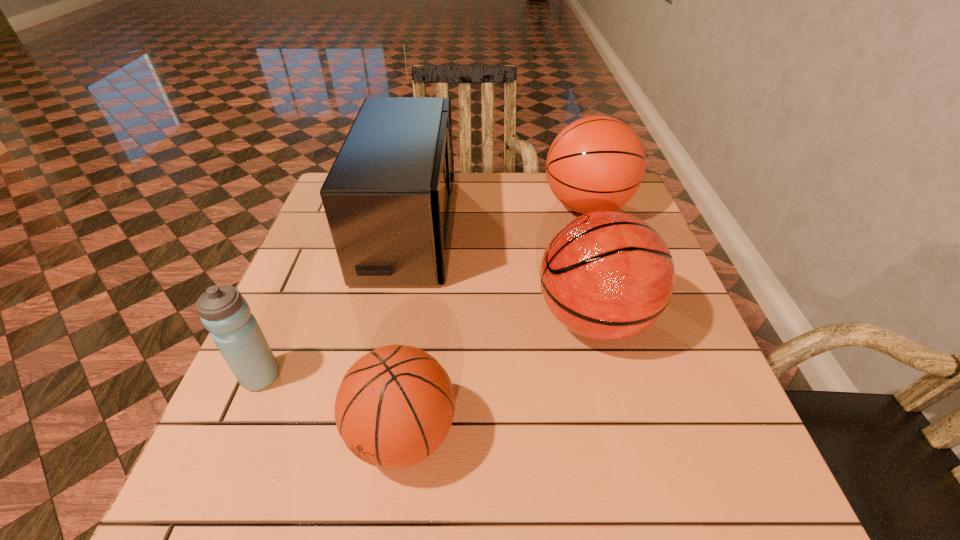
Identify the location of free space between the second farthest basketball and the microwave_oven. (501, 273).

The image size is (960, 540). I want to click on free space between the second nearest basketball and the water bottle, so coord(427,348).

At what (x,y) coordinates should I click in order to perform the action: click on free spot between the shortest object and the farthest basketball. Please return your answer as a coordinate pair (x, y). Image resolution: width=960 pixels, height=540 pixels. Looking at the image, I should click on click(x=495, y=321).

At what (x,y) coordinates should I click in order to perform the action: click on vacant point located between the microwave_oven and the leftmost object. Please return your answer as a coordinate pair (x, y). Image resolution: width=960 pixels, height=540 pixels. Looking at the image, I should click on (335, 302).

Locate which object is the second closest to the second nearest basketball. Please provide its 2D coordinates. Your answer should be formatted as a tuple, i.e. [(x, y)], where the tuple contains the x and y coordinates of a point satisfying the conditions above.

[(597, 163)]

Choose which object is the fourth nearest neighbor to the water bottle. Please provide its 2D coordinates. Your answer should be formatted as a tuple, i.e. [(x, y)], where the tuple contains the x and y coordinates of a point satisfying the conditions above.

[(597, 163)]

This screenshot has width=960, height=540. In order to click on the third closest basketball to the microwave_oven in this screenshot , I will do `click(395, 406)`.

Find the location of `basketball identified as the closest to the microwave_oven`. basketball identified as the closest to the microwave_oven is located at coordinates [606, 275].

The height and width of the screenshot is (540, 960). Identify the location of free location that satisfies the following two spatial constraints: 1. on the back side of the nearest basketball; 2. on the front-facing side of the microwave_oven. (431, 227).

Image resolution: width=960 pixels, height=540 pixels. I want to click on vacant area in the image that satisfies the following two spatial constraints: 1. on the front-facing side of the shortest object; 2. on the left side of the microwave_oven, so click(x=369, y=434).